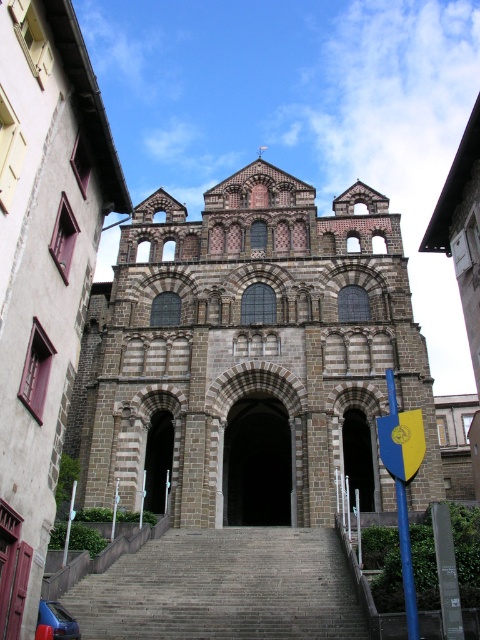
You are standing in front of the historic stone church and want to take a photo of the gray stone stairs at center and the brown stone arch at center. Which one appears larger in the photo?

The brown stone arch at center appears larger in the photo because it is larger than the gray stone stairs at center.

You are standing in front of the historic stone church and want to take a photo. You notice two points marked on the church facade at coordinates point (276, 518) and point (167, 417). Which point is closer to your camera position?

Point (167, 417) is closer to the camera position because it is less further than point (276, 518) according to their coordinates.

You are an architect planning to install a decorative element on the facade of the historic stone church. You have two options for placement locations based on the archways present. The first option is the dark stone archway at center, and the second is the brown stone archway at center. Considering the size of these archways, which location would allow for a larger decorative element without overcrowding the space?

The dark stone archway at center has a larger size compared to the brown stone archway at center, so the decorative element should be placed on the dark stone archway at center to accommodate a larger design without overcrowding.